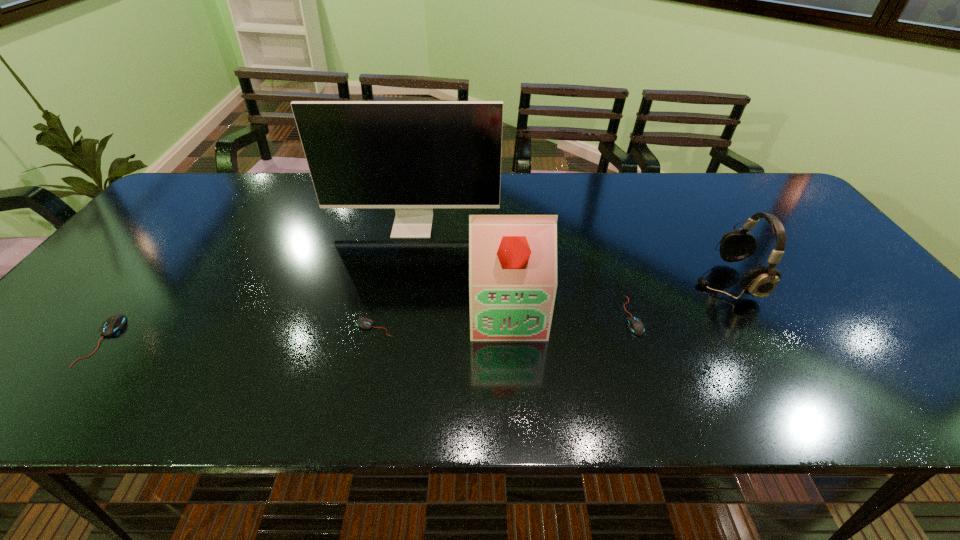
At what (x,y) coordinates should I click in order to perform the action: click on vacant area in the image that satisfies the following two spatial constraints: 1. on the front-facing side of the monitor; 2. on the left side of the second shortest mouse. Please return your answer as a coordinate pair (x, y). The height and width of the screenshot is (540, 960). Looking at the image, I should click on (396, 316).

Identify the location of vacant space that satisfies the following two spatial constraints: 1. with the cap open on the second shortest mouse; 2. on the left side of the soya milk. (508, 316).

Where is `free spot that satisfies the following two spatial constraints: 1. with the microphone on the side of the rightmost object; 2. on the front side of the leftmost object`? free spot that satisfies the following two spatial constraints: 1. with the microphone on the side of the rightmost object; 2. on the front side of the leftmost object is located at coordinates (761, 340).